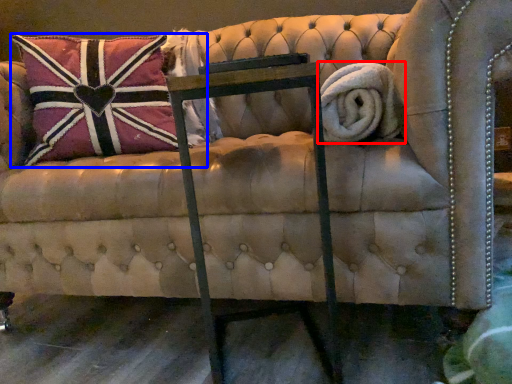
Question: Which object is further to the camera taking this photo, bath towel (highlighted by a red box) or pillow (highlighted by a blue box)?

Choices:
 (A) bath towel
 (B) pillow

Answer: (B)